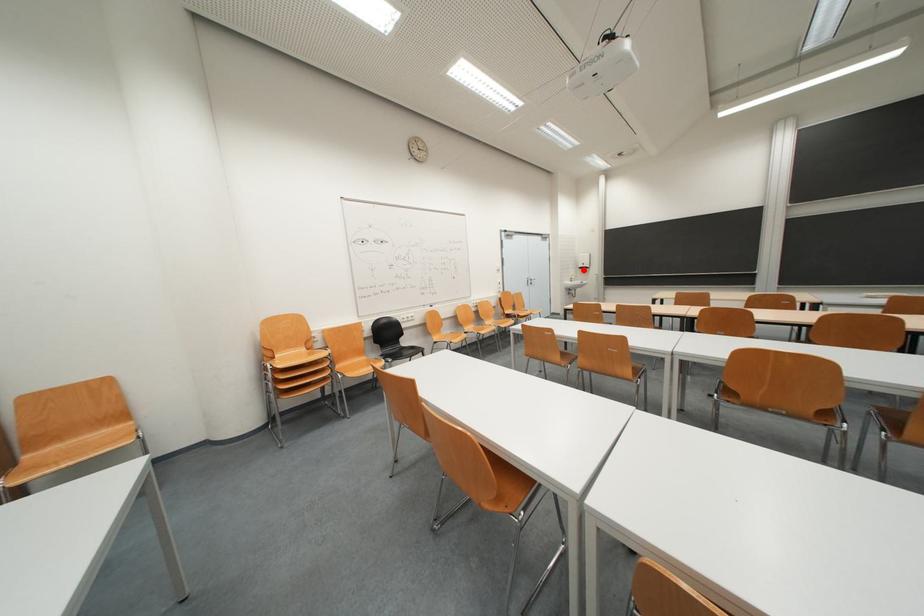
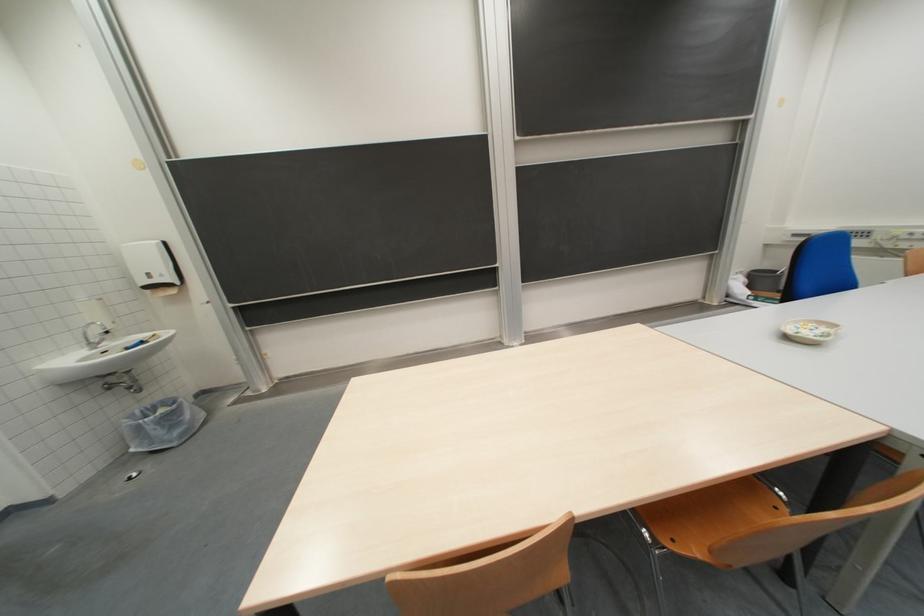
Question: I am providing you with two images of the same scene from different viewpoints. Image1 has a red point marked. In image2, the corresponding 3D location appears at what relative position? Reply with the corresponding letter.

Choices:
 (A) Closer
 (B) Farther

Answer: (B)